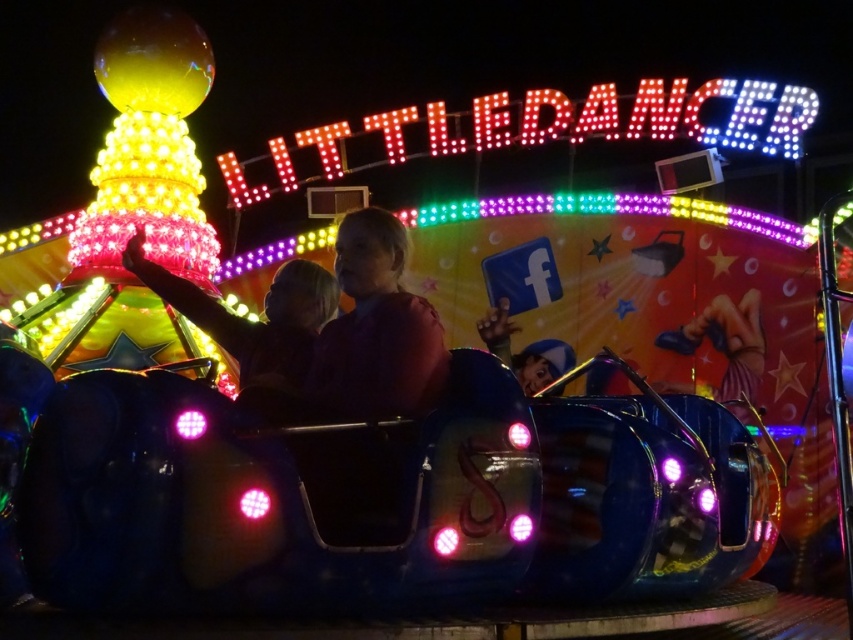
Question: Is pink matte shirt at center bigger than shiny metallic car at center?

Choices:
 (A) no
 (B) yes

Answer: (A)

Question: Does pink matte shirt at center have a larger size compared to shiny metallic car at center?

Choices:
 (A) no
 (B) yes

Answer: (A)

Question: Which point is farther from the camera taking this photo?

Choices:
 (A) (311, 369)
 (B) (154, 269)

Answer: (B)

Question: Is pink matte shirt at center to the right of shiny metallic car at center from the viewer's perspective?

Choices:
 (A) no
 (B) yes

Answer: (B)

Question: Among these objects, which one is farthest from the camera?

Choices:
 (A) pink matte shirt at center
 (B) shiny metallic car at center

Answer: (B)